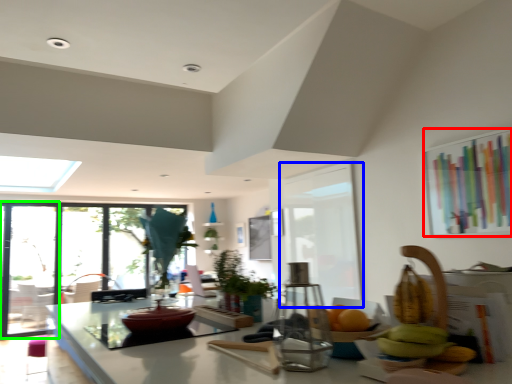
Question: Which object is the closest to the window screen (highlighted by a red box)? Choose among these: screen door (highlighted by a blue box) or screen door (highlighted by a green box).

Choices:
 (A) screen door
 (B) screen door

Answer: (A)